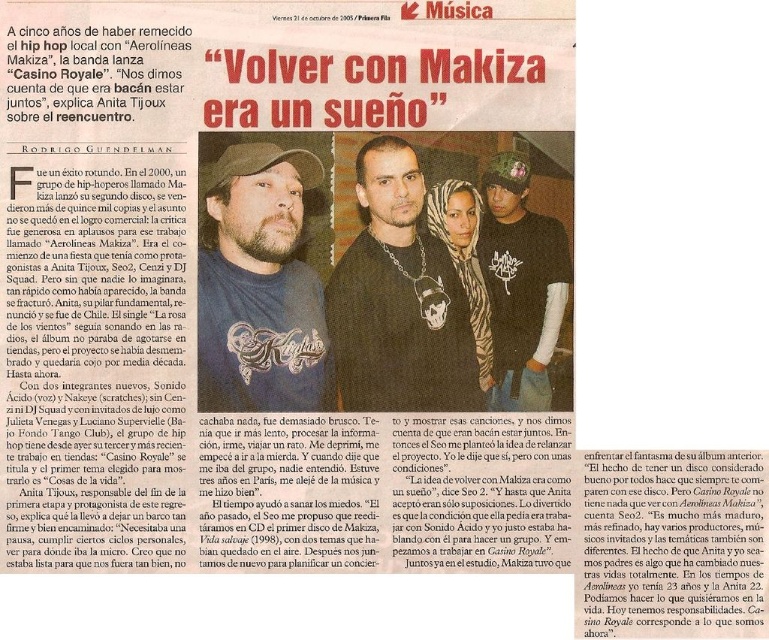
Question: Is matte black laptop at center thinner than matte black shirt at center?

Choices:
 (A) no
 (B) yes

Answer: (A)

Question: Is matte black chain at center smaller than matte black shirt at center?

Choices:
 (A) no
 (B) yes

Answer: (A)

Question: Which point is farther to the camera?

Choices:
 (A) (395, 250)
 (B) (260, 228)
 (C) (564, 48)
 (D) (491, 332)

Answer: (A)

Question: Is the position of matte black chain at center less distant than that of matte black shirt at center?

Choices:
 (A) yes
 (B) no

Answer: (B)

Question: Estimate the real-world distances between objects in this image. Which object is closer to the matte black shirt at center?

Choices:
 (A) matte black laptop at center
 (B) matte black chain at center

Answer: (B)

Question: Which point is farther to the camera?

Choices:
 (A) matte black shirt at center
 (B) matte black laptop at center
 (C) matte black chain at center

Answer: (C)